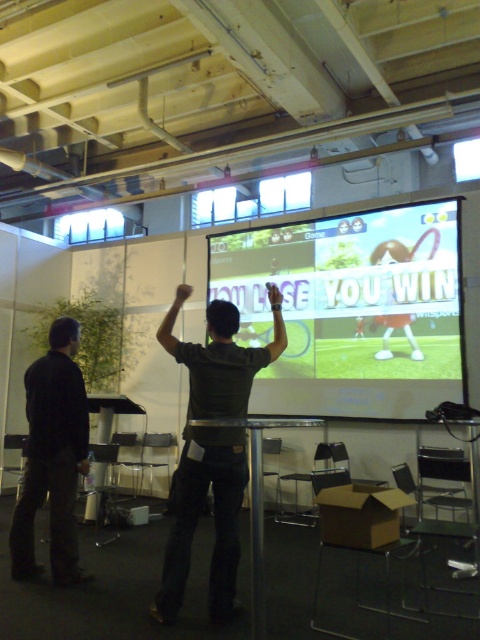
Does point (269, 317) lie in front of point (63, 432)?

No, it is behind (63, 432).

Which is in front, point (402, 307) or point (58, 500)?

Positioned in front is point (58, 500).

Measure the distance between matte green screen at center and camera.

matte green screen at center and camera are 16.61 feet apart from each other.

Locate an element on the screen. Image resolution: width=480 pixels, height=640 pixels. matte green screen at center is located at coordinates (351, 308).

Is matte green screen at center taller than dark green shirt at center?

Correct, matte green screen at center is much taller as dark green shirt at center.

Does matte green screen at center appear under dark green shirt at center?

Incorrect, matte green screen at center is not positioned below dark green shirt at center.

This screenshot has width=480, height=640. I want to click on matte green screen at center, so click(351, 308).

Can you confirm if dark green shirt at center is thinner than dark gray shirt at left?

No.

Is point (195, 474) farther from viewer compared to point (63, 442)?

No.

Does point (203, 369) lie behind point (48, 401)?

No, it is not.

Locate an element on the screen. This screenshot has height=640, width=480. dark green shirt at center is located at coordinates (212, 449).